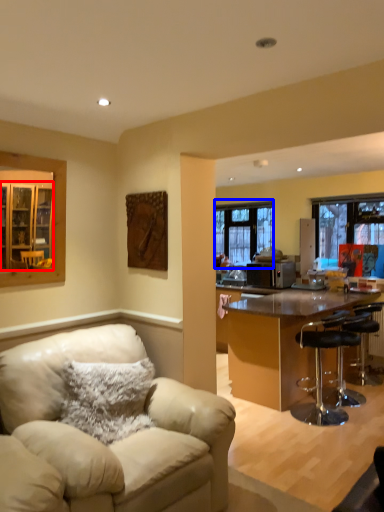
Question: Among these objects, which one is farthest to the camera, cabinetry (highlighted by a red box) or window (highlighted by a blue box)?

Choices:
 (A) cabinetry
 (B) window

Answer: (B)